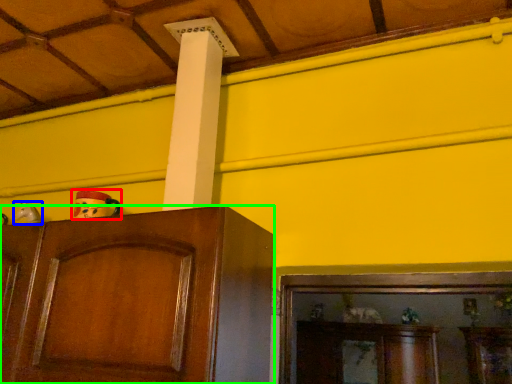
Question: Estimate the real-world distances between objects in this image. Which object is closer to toy (highlighted by a red box), toy (highlighted by a blue box) or cabinetry (highlighted by a green box)?

Choices:
 (A) toy
 (B) cabinetry

Answer: (B)